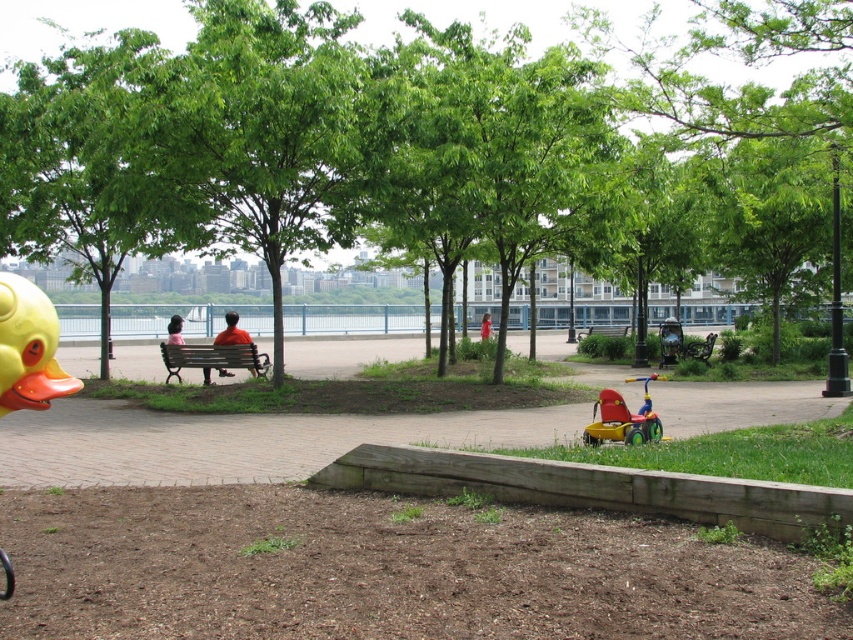
Does rubber yellow duck at left have a lesser width compared to red fabric shirt at center?

Indeed, rubber yellow duck at left has a lesser width compared to red fabric shirt at center.

Can you confirm if rubber yellow duck at left is shorter than red fabric shirt at center?

Yes, rubber yellow duck at left is shorter than red fabric shirt at center.

Locate an element on the screen. The width and height of the screenshot is (853, 640). rubber yellow duck at left is located at coordinates (28, 348).

The width and height of the screenshot is (853, 640). I want to click on rubber yellow duck at left, so click(x=28, y=348).

This screenshot has height=640, width=853. What do you see at coordinates (213, 356) in the screenshot?
I see `wooden bench at center` at bounding box center [213, 356].

Which is behind, point (228, 365) or point (488, 337)?

The point (488, 337) is behind.

Image resolution: width=853 pixels, height=640 pixels. Describe the element at coordinates (213, 356) in the screenshot. I see `wooden bench at center` at that location.

Where is `wooden bench at center`? This screenshot has width=853, height=640. wooden bench at center is located at coordinates (213, 356).

Who is lower down, red plastic tricycle at lower center or wooden bench at center?

Positioned lower is red plastic tricycle at lower center.

Describe the element at coordinates (624, 419) in the screenshot. I see `red plastic tricycle at lower center` at that location.

Which is in front, point (630, 413) or point (263, 369)?

Point (630, 413)

Where is `red plastic tricycle at lower center`? red plastic tricycle at lower center is located at coordinates (624, 419).